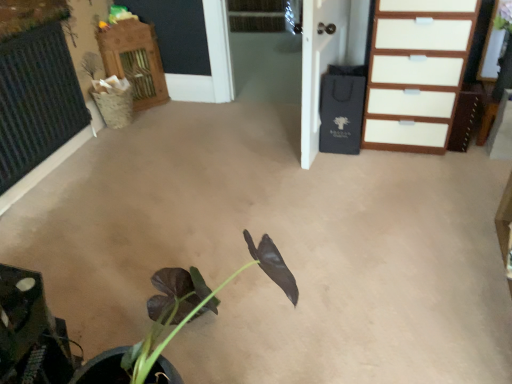
Question: Is wooden cabinet at upper left not near white glossy chest of drawers at upper right?

Choices:
 (A) yes
 (B) no

Answer: (A)

Question: From the image's perspective, would you say wooden cabinet at upper left is shown under white glossy chest of drawers at upper right?

Choices:
 (A) no
 (B) yes

Answer: (A)

Question: Is wooden cabinet at upper left closer to camera compared to white glossy chest of drawers at upper right?

Choices:
 (A) yes
 (B) no

Answer: (B)

Question: Could you tell me if wooden cabinet at upper left is facing white glossy chest of drawers at upper right?

Choices:
 (A) yes
 (B) no

Answer: (B)

Question: Is wooden cabinet at upper left wider than white glossy chest of drawers at upper right?

Choices:
 (A) yes
 (B) no

Answer: (B)

Question: Does point (391, 72) appear closer or farther from the camera than point (348, 3)?

Choices:
 (A) farther
 (B) closer

Answer: (B)

Question: From the image's perspective, is white glossy chest of drawers at upper right positioned above or below black paper bag at upper right?

Choices:
 (A) below
 (B) above

Answer: (A)

Question: In terms of width, does white glossy chest of drawers at upper right look wider or thinner when compared to black paper bag at upper right?

Choices:
 (A) wide
 (B) thin

Answer: (A)

Question: From a real-world perspective, is white glossy chest of drawers at upper right physically located above or below black paper bag at upper right?

Choices:
 (A) above
 (B) below

Answer: (B)

Question: Considering the positions of white glossy chest of drawers at upper right and wooden cabinet at upper left in the image, is white glossy chest of drawers at upper right bigger or smaller than wooden cabinet at upper left?

Choices:
 (A) small
 (B) big

Answer: (B)

Question: Considering the positions of point (460, 14) and point (108, 44), is point (460, 14) closer or farther from the camera than point (108, 44)?

Choices:
 (A) closer
 (B) farther

Answer: (A)

Question: In terms of width, does white glossy chest of drawers at upper right look wider or thinner when compared to wooden cabinet at upper left?

Choices:
 (A) wide
 (B) thin

Answer: (A)

Question: From a real-world perspective, relative to wooden cabinet at upper left, is white glossy chest of drawers at upper right vertically above or below?

Choices:
 (A) above
 (B) below

Answer: (A)

Question: From a real-world perspective, is black paper bag at upper right above or below white glossy chest of drawers at upper right?

Choices:
 (A) above
 (B) below

Answer: (A)

Question: Looking at their shapes, would you say black paper bag at upper right is wider or thinner than white glossy chest of drawers at upper right?

Choices:
 (A) wide
 (B) thin

Answer: (B)